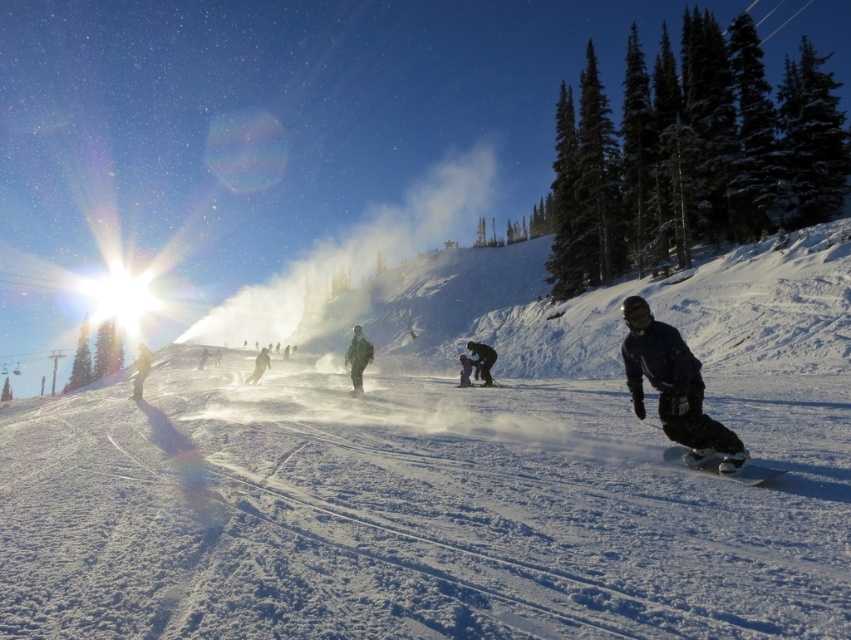
You are a photographer standing at the edge of the slope. You want to take a photo of the dark blue snowboard at center. Based on its position, where should you aim your camera to capture it in the frame?

The dark blue snowboard at center is located at the 2D coordinates point (672,387), so you should aim your camera towards that coordinate to capture it in the frame.

You are a photographer trying to capture both the dark blue snowboard at center and the shiny black snowboard at lower right in a single shot. Given their sizes, which snowboard will appear bigger in the photo?

The dark blue snowboard at center will appear bigger in the photo because it has a larger size compared to the shiny black snowboard at lower right.

You are a photographer planning to take a photo of the white powdery snow at center. The camera you are using has a focus point at coordinate point (x=450, y=470). Will this focus point align with the white powdery snow at center?

The white powdery snow at center is represented by point (x=450, y=470), so yes, the focus point at (x=450, y=470) will align with the white powdery snow at center.